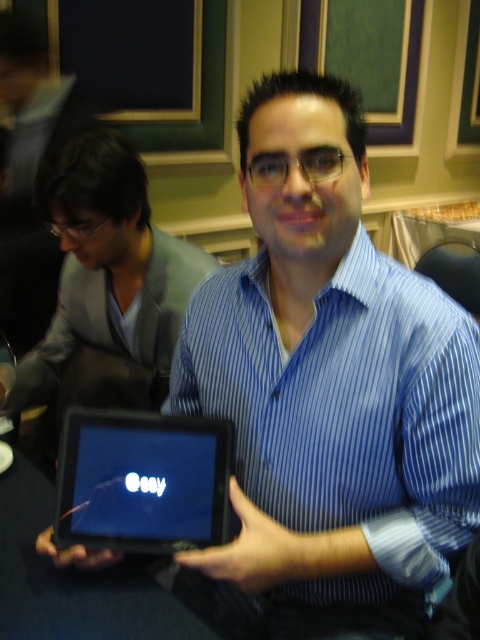
Is matte gray suit at left thinner than black matte tablet at center?

No.

Between point (36, 204) and point (158, 477), which one is positioned behind?

The point (36, 204) is behind.

Is point (46, 164) farther from viewer compared to point (164, 449)?

Yes, it is behind point (164, 449).

Find the location of `matte gray suit at left`. matte gray suit at left is located at coordinates (108, 268).